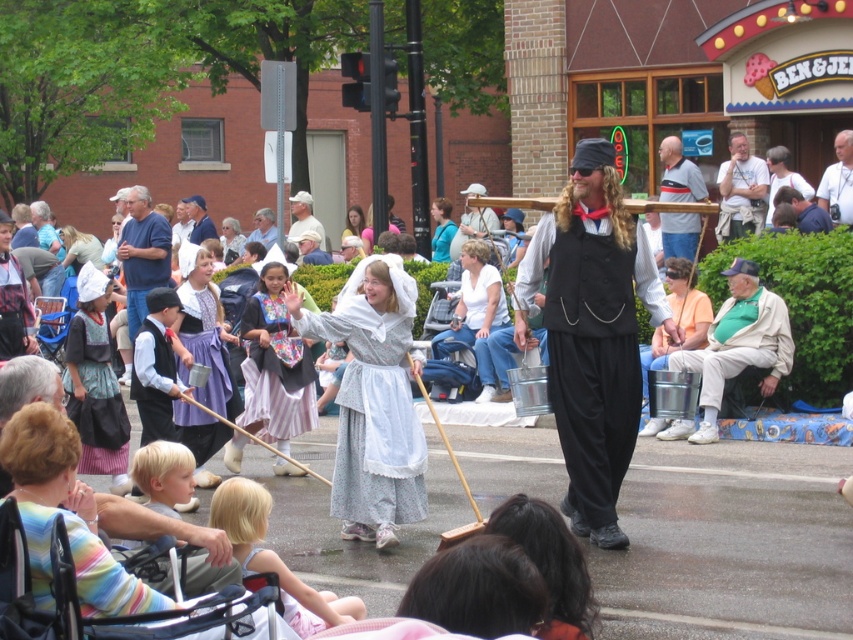
Who is more distant from viewer, (764, 177) or (299, 196)?

Positioned behind is point (299, 196).

Find the location of a particular element. This screenshot has height=640, width=853. white cotton shirt at upper center is located at coordinates (740, 189).

Locate an element on the screen. This screenshot has height=640, width=853. white cotton shirt at upper center is located at coordinates (740, 189).

Can you confirm if matte black vest at center is wider than blue denim shirt at upper center?

Yes, matte black vest at center is wider than blue denim shirt at upper center.

Locate an element on the screen. Image resolution: width=853 pixels, height=640 pixels. matte black vest at center is located at coordinates (590, 332).

What do you see at coordinates (590, 332) in the screenshot? I see `matte black vest at center` at bounding box center [590, 332].

At what (x,y) coordinates should I click in order to perform the action: click on matte black vest at center. Please return your answer as a coordinate pair (x, y). Looking at the image, I should click on (590, 332).

Is green fabric shirt at center taller than white cotton shirt at upper right?

Indeed, green fabric shirt at center has a greater height compared to white cotton shirt at upper right.

Which is in front, point (764, 374) or point (799, 177)?

Point (764, 374) is in front.

Identify the location of green fabric shirt at center. (735, 348).